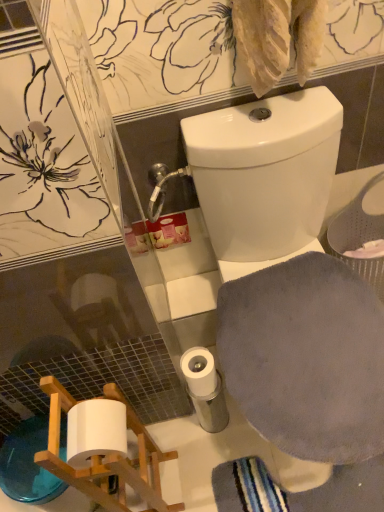
Find the location of a particular element. Image resolution: width=384 pixels, height=512 pixels. white matte toilet paper at lower center is located at coordinates (199, 371).

Which is more to the right, gray soft cloth at lower right or white glossy toilet at upper center?

gray soft cloth at lower right is more to the right.

What's the angular difference between gray soft cloth at lower right and white glossy toilet at upper center's facing directions?

0.000221 degrees separate the facing orientations of gray soft cloth at lower right and white glossy toilet at upper center.

From a real-world perspective, is gray soft cloth at lower right located higher than white glossy toilet at upper center?

Yes.

Considering their positions, is gray soft cloth at lower right located in front of or behind white glossy toilet at upper center?

gray soft cloth at lower right is positioned farther from the viewer than white glossy toilet at upper center.

Is white matte toilet paper at lower center placed right next to white glossy toilet at upper center?

No, white matte toilet paper at lower center is not next to white glossy toilet at upper center.

Considering the sizes of white matte toilet paper at lower center and white glossy toilet at upper center in the image, is white matte toilet paper at lower center wider or thinner than white glossy toilet at upper center?

Clearly, white matte toilet paper at lower center has less width compared to white glossy toilet at upper center.

From the image's perspective, which object appears higher, white matte toilet paper at lower center or white glossy toilet at upper center?

white glossy toilet at upper center is shown above in the image.

What's the angular difference between white matte toilet paper at lower center and white glossy toilet at upper center's facing directions?

0.000943 degrees separate the facing orientations of white matte toilet paper at lower center and white glossy toilet at upper center.

Is gray soft cloth at lower right not close to white matte toilet paper at lower center?

No.

From a real-world perspective, is gray soft cloth at lower right positioned over white matte toilet paper at lower center based on gravity?

Correct, in the physical world, gray soft cloth at lower right is higher than white matte toilet paper at lower center.

Could you tell me if gray soft cloth at lower right is facing white matte toilet paper at lower center?

No, gray soft cloth at lower right is not oriented towards white matte toilet paper at lower center.

Is gray soft cloth at lower right surrounding white matte toilet paper at lower center?

No, white matte toilet paper at lower center is not inside gray soft cloth at lower right.

In the scene shown: Considering the positions of objects white matte toilet paper at lower center and gray soft cloth at lower right in the image provided, who is more to the left, white matte toilet paper at lower center or gray soft cloth at lower right?

white matte toilet paper at lower center.

Can you confirm if white matte toilet paper at lower center is smaller than gray soft cloth at lower right?

Yes, white matte toilet paper at lower center is smaller than gray soft cloth at lower right.

I want to click on bath towel above the white matte toilet paper at lower center (from a real-world perspective), so click(306, 357).

Would you say white matte toilet paper at lower center is inside or outside gray soft cloth at lower right?

white matte toilet paper at lower center is outside gray soft cloth at lower right.

Could you tell me if white glossy toilet at upper center is facing gray soft cloth at lower right?

Yes, white glossy toilet at upper center is facing gray soft cloth at lower right.

From the image's perspective, is white glossy toilet at upper center above or below gray soft cloth at lower right?

white glossy toilet at upper center is situated higher than gray soft cloth at lower right in the image.

Considering the relative positions of white glossy toilet at upper center and gray soft cloth at lower right in the image provided, is white glossy toilet at upper center behind gray soft cloth at lower right?

No, the depth of white glossy toilet at upper center is less than that of gray soft cloth at lower right.

From a real-world perspective, which is physically above, white glossy toilet at upper center or gray soft cloth at lower right?

gray soft cloth at lower right, from a real-world perspective.

Does white glossy toilet at upper center lie behind white matte toilet paper at lower center?

No, it is not.

Which object is positioned more to the right, white glossy toilet at upper center or white matte toilet paper at lower center?

From the viewer's perspective, white glossy toilet at upper center appears more on the right side.

From a real-world perspective, which is physically below, white glossy toilet at upper center or white matte toilet paper at lower center?

white matte toilet paper at lower center.

Is white glossy toilet at upper center looking in the opposite direction of white matte toilet paper at lower center?

No, white glossy toilet at upper center is not facing away from white matte toilet paper at lower center.

The width and height of the screenshot is (384, 512). Identify the location of bath towel behind the white glossy toilet at upper center. (306, 357).

Where is `toilet that appears on the right of white matte toilet paper at lower center`? The image size is (384, 512). toilet that appears on the right of white matte toilet paper at lower center is located at coordinates (264, 176).

Estimate the real-world distances between objects in this image. Which object is further from white matte toilet paper at lower center, gray soft cloth at lower right or white glossy toilet at upper center?

The object further to white matte toilet paper at lower center is white glossy toilet at upper center.

Considering their positions, is white glossy toilet at upper center positioned further to white matte toilet paper at lower center than gray soft cloth at lower right?

white glossy toilet at upper center is positioned further to the anchor white matte toilet paper at lower center.

Based on their spatial positions, is white matte toilet paper at lower center or white glossy toilet at upper center further from gray soft cloth at lower right?

Based on the image, white matte toilet paper at lower center appears to be further to gray soft cloth at lower right.

Considering their positions, is white glossy toilet at upper center positioned closer to gray soft cloth at lower right than white matte toilet paper at lower center?

white glossy toilet at upper center is positioned closer to the anchor gray soft cloth at lower right.

Based on their spatial positions, is white matte toilet paper at lower center or gray soft cloth at lower right further from white glossy toilet at upper center?

The object further to white glossy toilet at upper center is white matte toilet paper at lower center.

Considering their positions, is gray soft cloth at lower right positioned closer to white glossy toilet at upper center than white matte toilet paper at lower center?

gray soft cloth at lower right.

This screenshot has width=384, height=512. What are the coordinates of `bath towel between white glossy toilet at upper center and white matte toilet paper at lower center from front to back` in the screenshot? It's located at (306, 357).